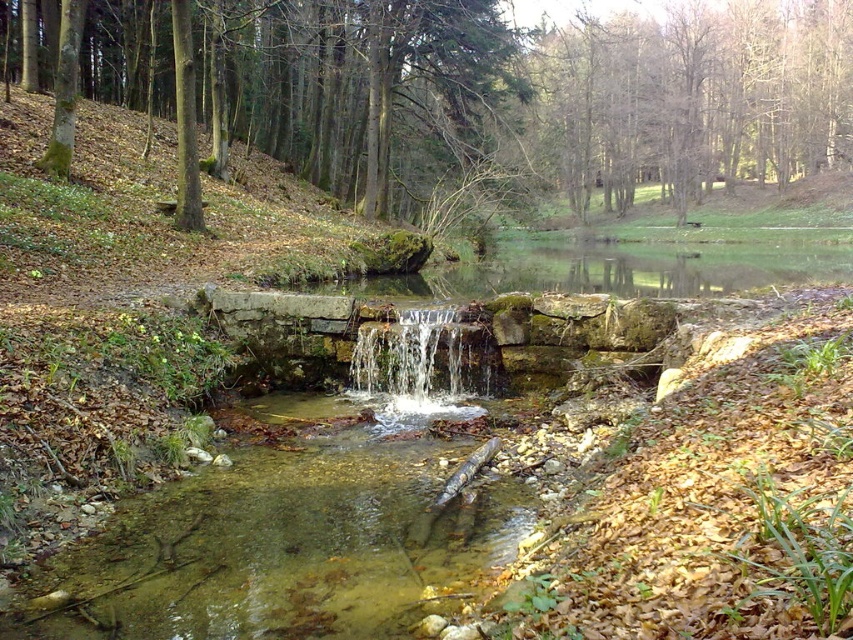
Question: Does bare wood trees at upper center have a greater width compared to clear stone waterfall at center?

Choices:
 (A) no
 (B) yes

Answer: (B)

Question: Considering the relative positions of bare wood trees at upper center and clear stone waterfall at center in the image provided, where is bare wood trees at upper center located with respect to clear stone waterfall at center?

Choices:
 (A) above
 (B) below

Answer: (A)

Question: Is brown wood tree at upper center further to the viewer compared to clear stone waterfall at center?

Choices:
 (A) no
 (B) yes

Answer: (B)

Question: Which object is the closest to the clear stone waterfall at center?

Choices:
 (A) bare wood trees at upper center
 (B) brown wood tree at upper center

Answer: (B)

Question: Which object appears closest to the camera in this image?

Choices:
 (A) brown wood tree at upper center
 (B) clear stone waterfall at center

Answer: (B)

Question: Which object appears closest to the camera in this image?

Choices:
 (A) clear stone waterfall at center
 (B) brown wood tree at upper center

Answer: (A)